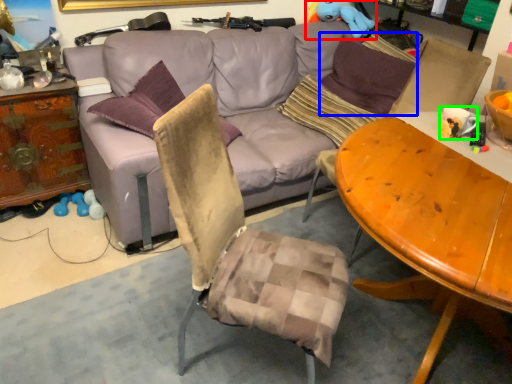
Question: Based on their relative distances, which object is farther from toy (highlighted by a red box)? Choose from pillow (highlighted by a blue box) and coffee cup (highlighted by a green box).

Choices:
 (A) pillow
 (B) coffee cup

Answer: (B)